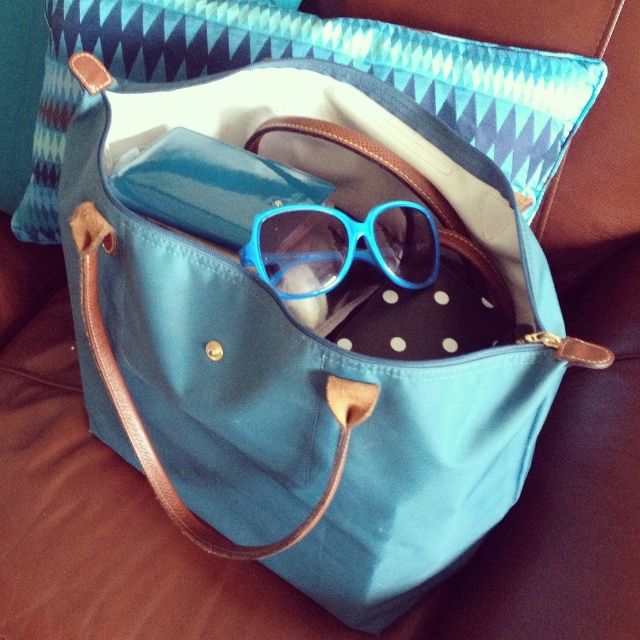
Between teal zigzag fabric pillow at upper center and blue matte sunglasses at center, which one is positioned higher?

teal zigzag fabric pillow at upper center is above.

Does teal zigzag fabric pillow at upper center have a larger size compared to blue matte sunglasses at center?

Yes.

Where is `teal zigzag fabric pillow at upper center`? This screenshot has width=640, height=640. teal zigzag fabric pillow at upper center is located at coordinates (312, 58).

At what (x,y) coordinates should I click in order to perform the action: click on teal zigzag fabric pillow at upper center. Please return your answer as a coordinate pair (x, y). Looking at the image, I should click on (312, 58).